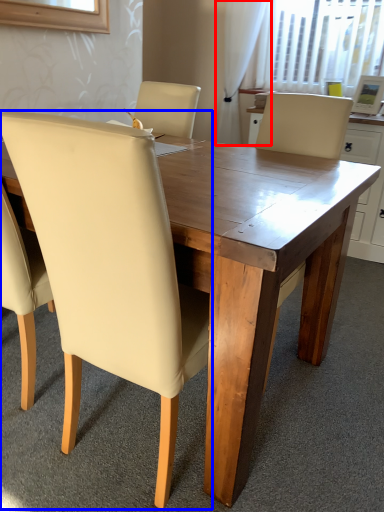
Question: Which object is further to the camera taking this photo, curtain (highlighted by a red box) or chair (highlighted by a blue box)?

Choices:
 (A) curtain
 (B) chair

Answer: (A)